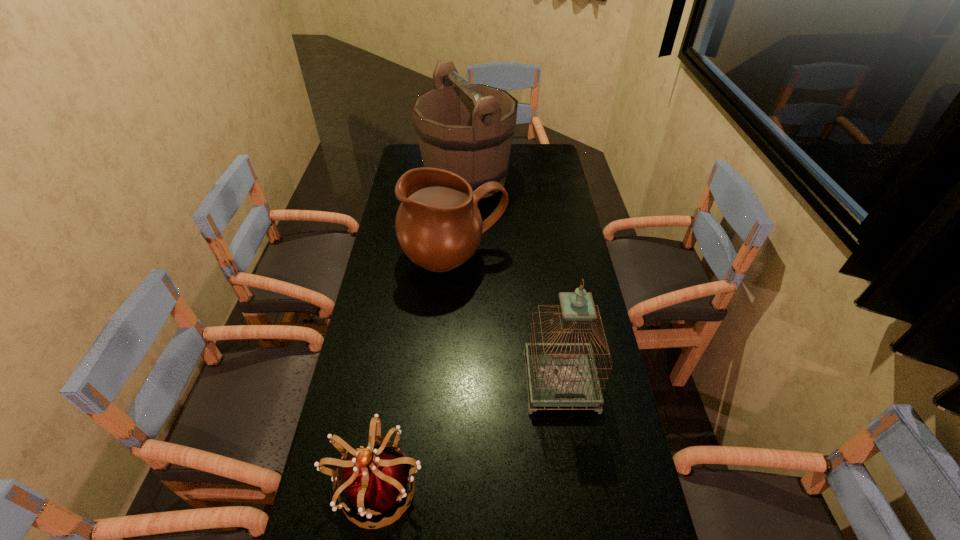
Find the location of `vacant space in between the nearest object and the cream pitcher`. vacant space in between the nearest object and the cream pitcher is located at coordinates (416, 371).

Locate an element on the screen. Image resolution: width=960 pixels, height=540 pixels. empty location between the third nearest object and the tiara is located at coordinates (416, 371).

Where is `free space between the tiara and the third farthest object`? The width and height of the screenshot is (960, 540). free space between the tiara and the third farthest object is located at coordinates (469, 433).

I want to click on empty space that is in between the third farthest object and the tiara, so click(469, 433).

Where is `vacant region between the shortest object and the cream pitcher`? The width and height of the screenshot is (960, 540). vacant region between the shortest object and the cream pitcher is located at coordinates (416, 371).

The height and width of the screenshot is (540, 960). What are the coordinates of `object that stands as the second closest to the tiara` in the screenshot? It's located at (438, 224).

Locate an element on the screen. object that is the third nearest to the second nearest object is located at coordinates (x=467, y=129).